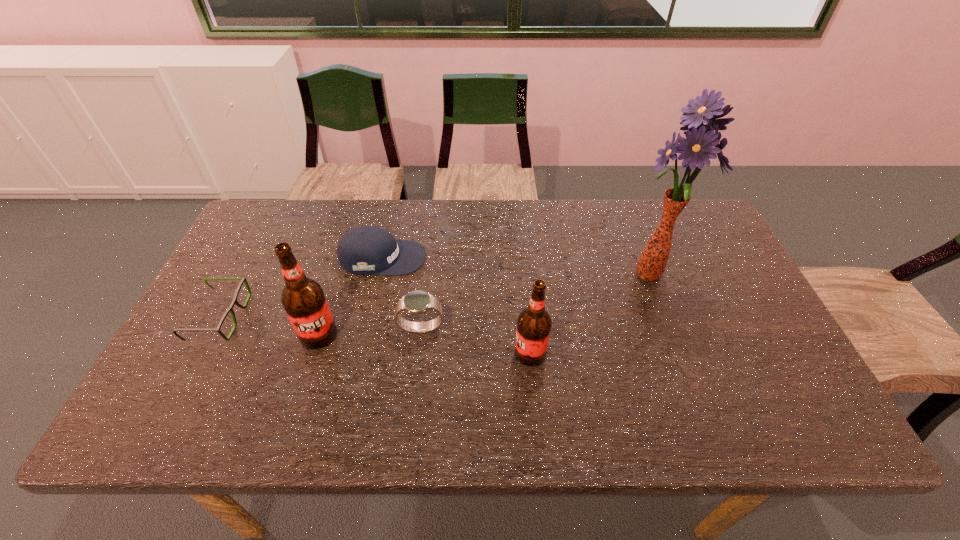
You are a GUI agent. You are given a task and a screenshot of the screen. Output one action in this format:
    pyautogui.click(x=<x>, y=<y>)
    Task: Click on the vacant point located 0.240m on the left of the fifth shortest object
    
    Given the screenshot: What is the action you would take?
    pyautogui.click(x=205, y=335)

You are a GUI agent. You are given a task and a screenshot of the screen. Output one action in this format:
    pyautogui.click(x=<x>, y=<y>)
    Task: Click on the free spot located 0.350m on the left of the shorter root beer
    This screenshot has height=540, width=960.
    Given the screenshot: What is the action you would take?
    pyautogui.click(x=371, y=354)

The height and width of the screenshot is (540, 960). In order to click on vacant position located 0.130m on the front-facing side of the baseball cap in this screenshot , I will do tap(469, 258).

Identify the location of blank area located 0.330m on the right of the watch. The image size is (960, 540). (573, 328).

I want to click on vacant region located 0.220m on the back of the tallest object, so click(x=622, y=208).

This screenshot has height=540, width=960. What are the coordinates of `free space located on the lens of the leftmost object` in the screenshot? It's located at (314, 317).

What are the coordinates of `object located at the far edge` in the screenshot? It's located at (364, 250).

The image size is (960, 540). I want to click on object that is at the near edge, so click(x=534, y=323).

Locate an element on the screen. object at the left edge is located at coordinates (243, 280).

Identify the location of free space at the far edge of the desktop. 313,199.